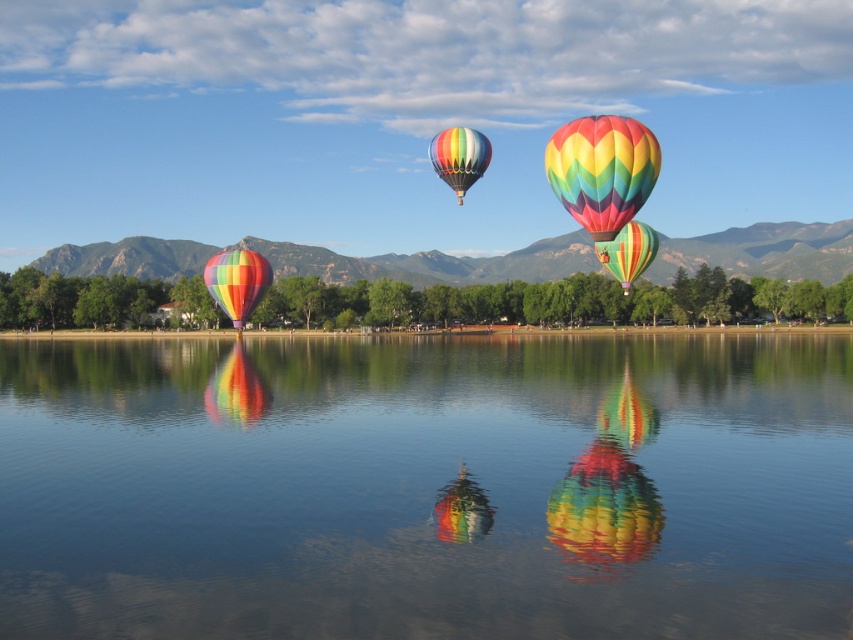
You are a photographer standing at the edge of the water. You want to capture the reflection of the hot air balloons in the transparent glass water at center. Where exactly should you position your camera to ensure the reflection is clearly visible?

To capture the reflection of the hot air balloons in the transparent glass water at center, position your camera at point (428, 488) where the transparent glass water at center is located.

You are standing on the shore of the lake and see two points in the sky where the hot air balloons are anchored. The points are labeled as point 1 at coordinates point (430,157) and point 2 at coordinates point (640,269). Which point is closer to you?

Point (430,157) is closer to the viewer than point (640,269).

You are a drone operator trying to capture a photo of the rainbow striped hot air balloon at upper center and the transparent glass water at center. Your drone has a maximum flight range of 100 feet. Can you fly the drone from the balloon to the water without exceeding its range?

The distance between the rainbow striped hot air balloon at upper center and the transparent glass water at center is 108.98 feet, which exceeds the drone operator maximum flight range of 100 feet. Therefore, the drone cannot fly from the balloon to the water without exceeding its range.